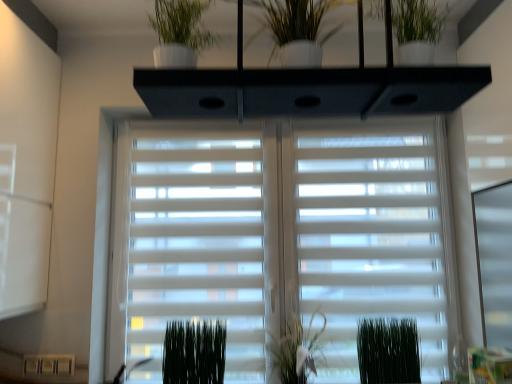
Describe the element at coordinates (194, 352) in the screenshot. I see `green matte plant at lower center, which is counted as the 1th plant, starting from the left` at that location.

I want to click on green matte plant at center, which appears as the 2th plant when viewed from the left, so click(x=296, y=350).

Measure the distance between white glossy vase at upper center and camera.

white glossy vase at upper center is 3.37 feet away from camera.

The height and width of the screenshot is (384, 512). What are the coordinates of `green matte plant at lower center, which is counted as the 3th plant, starting from the right` in the screenshot? It's located at pyautogui.click(x=194, y=352).

Considering the sizes of objects green matte plant at lower center, which is counted as the 1th plant, starting from the left, and white glossy vase at upper center in the image provided, who is bigger, green matte plant at lower center, which is counted as the 1th plant, starting from the left, or white glossy vase at upper center?

white glossy vase at upper center.

From the image's perspective, is green matte plant at lower center, which is counted as the 1th plant, starting from the left, on top of white glossy vase at upper center?

Actually, green matte plant at lower center, which is counted as the 1th plant, starting from the left, appears below white glossy vase at upper center in the image.

Considering the positions of point (186, 351) and point (313, 21), is point (186, 351) closer or farther from the camera than point (313, 21)?

Point (186, 351) is farther from the camera than point (313, 21).

Is green matte plant at lower center, which is counted as the 3th plant, starting from the right, wider or thinner than white glossy vase at upper center?

In the image, green matte plant at lower center, which is counted as the 3th plant, starting from the right, appears to be more narrow than white glossy vase at upper center.

How distant is green matte plant at center, which appears as the 2th plant when viewed from the left, from green matte plant at lower center, which is counted as the 1th plant, starting from the left?

They are 35.92 centimeters apart.

Would you say green matte plant at center, marked as the second plant in a right-to-left arrangement, is outside green matte plant at lower center, which is counted as the 1th plant, starting from the left?

Yes, green matte plant at center, marked as the second plant in a right-to-left arrangement, is not within green matte plant at lower center, which is counted as the 1th plant, starting from the left.

In the scene shown: Between green matte plant at center, marked as the second plant in a right-to-left arrangement, and green matte plant at lower center, which is counted as the 3th plant, starting from the right, which one has smaller width?

green matte plant at lower center, which is counted as the 3th plant, starting from the right, is thinner.

Relative to green matte plant at lower center, which is counted as the 3th plant, starting from the right, is green matte plant at center, which appears as the 2th plant when viewed from the left, in front or behind?

Clearly, green matte plant at center, which appears as the 2th plant when viewed from the left, is in front of green matte plant at lower center, which is counted as the 3th plant, starting from the right.

Looking at the image, does green matte plant at lower right, the first plant in the right-to-left sequence, seem bigger or smaller compared to white glossy vase at upper center?

In the image, green matte plant at lower right, the first plant in the right-to-left sequence, appears to be smaller than white glossy vase at upper center.

From the image's perspective, which plant is the 2nd one below the white glossy vase at upper center? Please provide its 2D coordinates.

[(388, 351)]

Is the position of green matte plant at lower right, the third plant positioned from the left, less distant than that of white glossy vase at upper center?

No.

Between green matte plant at lower right, the third plant positioned from the left, and white glossy vase at upper center, which one has more height?

green matte plant at lower right, the third plant positioned from the left, is taller.

Which object is positioned more to the right, green matte plant at lower center, which is counted as the 3th plant, starting from the right, or white matte window blind at center?

white matte window blind at center.

From the picture: From the image's perspective, which one is positioned lower, green matte plant at lower center, which is counted as the 3th plant, starting from the right, or white matte window blind at center?

green matte plant at lower center, which is counted as the 3th plant, starting from the right, from the image's perspective.

Considering the sizes of objects green matte plant at lower center, which is counted as the 1th plant, starting from the left, and white matte window blind at center in the image provided, who is smaller, green matte plant at lower center, which is counted as the 1th plant, starting from the left, or white matte window blind at center?

With smaller size is green matte plant at lower center, which is counted as the 1th plant, starting from the left.

Are green matte plant at lower center, which is counted as the 3th plant, starting from the right, and white matte window blind at center making contact?

green matte plant at lower center, which is counted as the 3th plant, starting from the right, and white matte window blind at center are not in contact.

Which object is closer to the camera taking this photo, green matte plant at center, marked as the second plant in a right-to-left arrangement, or green matte plant at lower right, the third plant positioned from the left?

green matte plant at lower right, the third plant positioned from the left, is more forward.

From a real-world perspective, between green matte plant at center, marked as the second plant in a right-to-left arrangement, and green matte plant at lower right, the third plant positioned from the left, who is vertically higher?

From a 3D spatial view, green matte plant at center, marked as the second plant in a right-to-left arrangement, is above.

From the image's perspective, is green matte plant at center, which appears as the 2th plant when viewed from the left, beneath green matte plant at lower right, the third plant positioned from the left?

No, from the image's perspective, green matte plant at center, which appears as the 2th plant when viewed from the left, is not below green matte plant at lower right, the third plant positioned from the left.

This screenshot has width=512, height=384. Find the location of `window blind on the left of the green matte plant at center, marked as the second plant in a right-to-left arrangement`. window blind on the left of the green matte plant at center, marked as the second plant in a right-to-left arrangement is located at coordinates (283, 236).

Considering the relative positions of white matte window blind at center and green matte plant at center, marked as the second plant in a right-to-left arrangement, in the image provided, is white matte window blind at center to the right of green matte plant at center, marked as the second plant in a right-to-left arrangement, from the viewer's perspective?

In fact, white matte window blind at center is to the left of green matte plant at center, marked as the second plant in a right-to-left arrangement.

Between white matte window blind at center and green matte plant at center, marked as the second plant in a right-to-left arrangement, which one has larger width?

With larger width is green matte plant at center, marked as the second plant in a right-to-left arrangement.

Between white matte window blind at center and green matte plant at center, which appears as the 2th plant when viewed from the left, which one is positioned in front?

Positioned in front is green matte plant at center, which appears as the 2th plant when viewed from the left.

From the image's perspective, which is above, white matte window blind at center or white glossy vase at upper center?

white glossy vase at upper center is shown above in the image.

Is point (325, 144) in front of point (308, 55)?

No.

Could you tell me if white matte window blind at center is facing white glossy vase at upper center?

Yes, white matte window blind at center faces towards white glossy vase at upper center.

The width and height of the screenshot is (512, 384). Identify the location of houseplant that is above the green matte plant at lower center, which is counted as the 1th plant, starting from the left (from the image's perspective). (295, 29).

This screenshot has width=512, height=384. In order to click on the 1st plant in front when counting from the green matte plant at lower center, which is counted as the 1th plant, starting from the left in this screenshot , I will do `click(296, 350)`.

When comparing their distances from green matte plant at center, marked as the second plant in a right-to-left arrangement, does green matte plant at lower center, which is counted as the 3th plant, starting from the right, or white matte window blind at center seem further?

white matte window blind at center is positioned further to the anchor green matte plant at center, marked as the second plant in a right-to-left arrangement.

Estimate the real-world distances between objects in this image. Which object is further from green matte plant at lower right, the first plant in the right-to-left sequence, green matte plant at center, which appears as the 2th plant when viewed from the left, or white glossy vase at upper center?

white glossy vase at upper center.

Considering their positions, is green matte plant at lower center, which is counted as the 3th plant, starting from the right, positioned closer to white glossy vase at upper center than white matte window blind at center?

white matte window blind at center is positioned closer to the anchor white glossy vase at upper center.

From the image, which object appears to be farther from green matte plant at center, which appears as the 2th plant when viewed from the left, green matte plant at lower center, which is counted as the 1th plant, starting from the left, or green matte plant at lower right, the first plant in the right-to-left sequence?

The object further to green matte plant at center, which appears as the 2th plant when viewed from the left, is green matte plant at lower center, which is counted as the 1th plant, starting from the left.

Based on their spatial positions, is green matte plant at lower right, the first plant in the right-to-left sequence, or green matte plant at lower center, which is counted as the 1th plant, starting from the left, closer to white matte window blind at center?

green matte plant at lower center, which is counted as the 1th plant, starting from the left.

Estimate the real-world distances between objects in this image. Which object is further from white glossy vase at upper center, green matte plant at lower center, which is counted as the 1th plant, starting from the left, or green matte plant at lower right, the first plant in the right-to-left sequence?

green matte plant at lower right, the first plant in the right-to-left sequence.

Which object lies nearer to the anchor point green matte plant at lower right, the first plant in the right-to-left sequence, white glossy vase at upper center or white matte window blind at center?

white matte window blind at center lies closer to green matte plant at lower right, the first plant in the right-to-left sequence, than the other object.

When comparing their distances from green matte plant at lower center, which is counted as the 1th plant, starting from the left, does green matte plant at center, which appears as the 2th plant when viewed from the left, or white matte window blind at center seem further?

white matte window blind at center.

You are a GUI agent. You are given a task and a screenshot of the screen. Output one action in this format:
    pyautogui.click(x=<x>, y=<y>)
    Task: Click on the plant that lies between white glossy vase at upper center and green matte plant at lower right, the first plant in the right-to-left sequence, from top to bottom
    The height and width of the screenshot is (384, 512).
    Given the screenshot: What is the action you would take?
    pyautogui.click(x=296, y=350)

At what (x,y) coordinates should I click in order to perform the action: click on plant between white matte window blind at center and green matte plant at lower right, the first plant in the right-to-left sequence, in the vertical direction. Please return your answer as a coordinate pair (x, y). Looking at the image, I should click on (296, 350).

This screenshot has height=384, width=512. In order to click on window blind situated between green matte plant at lower center, which is counted as the 1th plant, starting from the left, and green matte plant at lower right, the first plant in the right-to-left sequence, from left to right in this screenshot , I will do `click(283, 236)`.

Find the location of `window blind located between green matte plant at lower center, which is counted as the 1th plant, starting from the left, and green matte plant at center, marked as the second plant in a right-to-left arrangement, in the left-right direction`. window blind located between green matte plant at lower center, which is counted as the 1th plant, starting from the left, and green matte plant at center, marked as the second plant in a right-to-left arrangement, in the left-right direction is located at coordinates (283, 236).